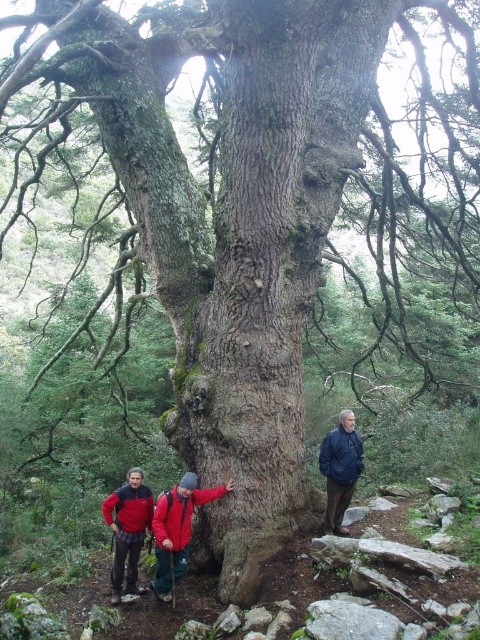
Question: Does red fleece jacket at lower left come behind blue jacket at center?

Choices:
 (A) yes
 (B) no

Answer: (B)

Question: Which point is closer to the camera taking this photo?

Choices:
 (A) (359, 442)
 (B) (103, 509)

Answer: (B)

Question: Based on their relative distances, which object is farther from the blue jacket at center?

Choices:
 (A) red fleece jacket at lower left
 (B) red fleece jackets at lower center

Answer: (A)

Question: Does red fleece jacket at lower left come behind blue jacket at center?

Choices:
 (A) yes
 (B) no

Answer: (B)

Question: Does red fleece jacket at lower left appear on the right side of blue jacket at center?

Choices:
 (A) yes
 (B) no

Answer: (B)

Question: Which point is closer to the camera taking this photo?

Choices:
 (A) (119, 520)
 (B) (340, 529)
 (C) (120, 556)

Answer: (A)